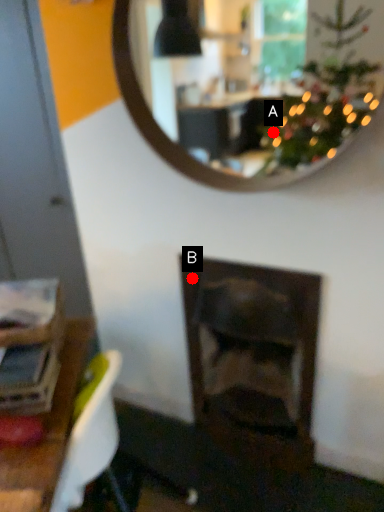
Question: Two points are circled on the image, labeled by A and B beside each circle. Which point is further to the camera?

Choices:
 (A) A is further
 (B) B is further

Answer: (A)